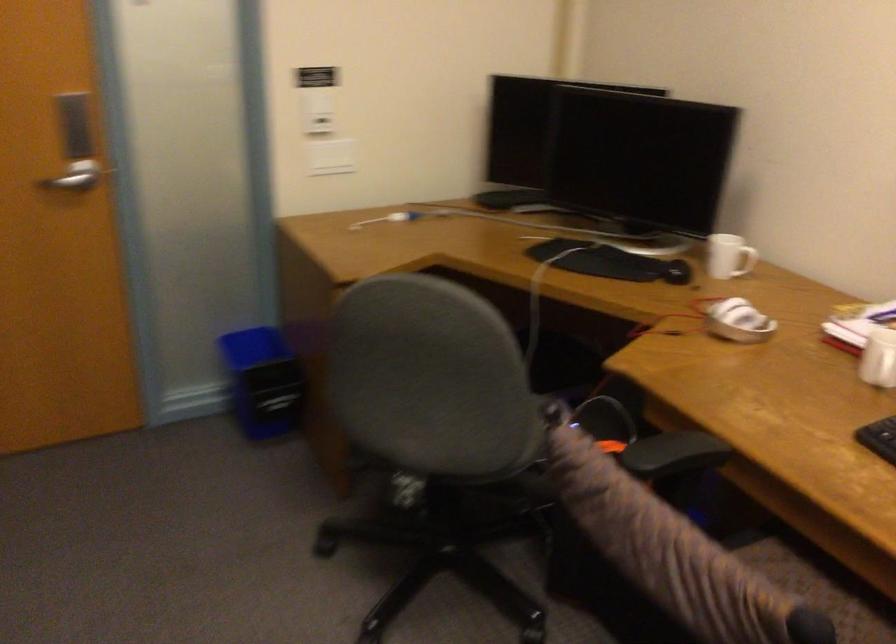
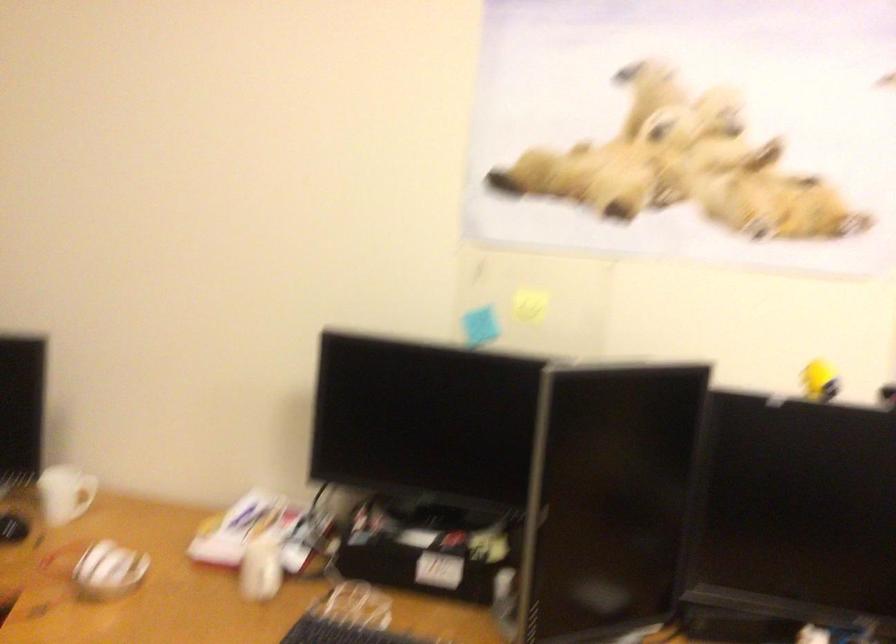
Question: The camera is either moving clockwise (left) or counter-clockwise (right) around the object. The first image is from the beginning of the video and the second image is from the end. Is the camera moving left or right when shooting the video?

Choices:
 (A) Left
 (B) Right

Answer: (A)